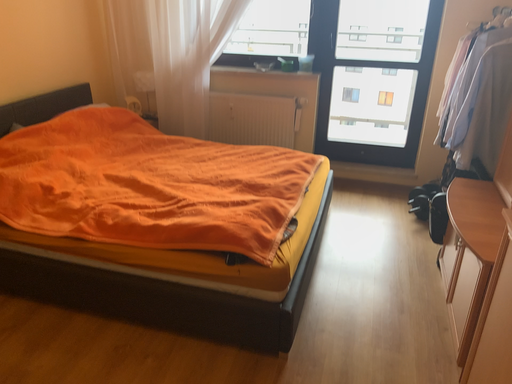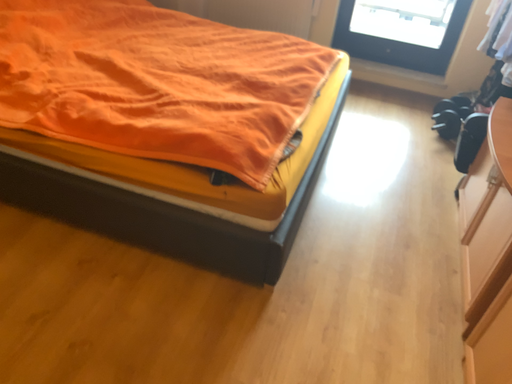
Question: How did the camera likely rotate when shooting the video?

Choices:
 (A) rotated downward
 (B) rotated upward

Answer: (A)